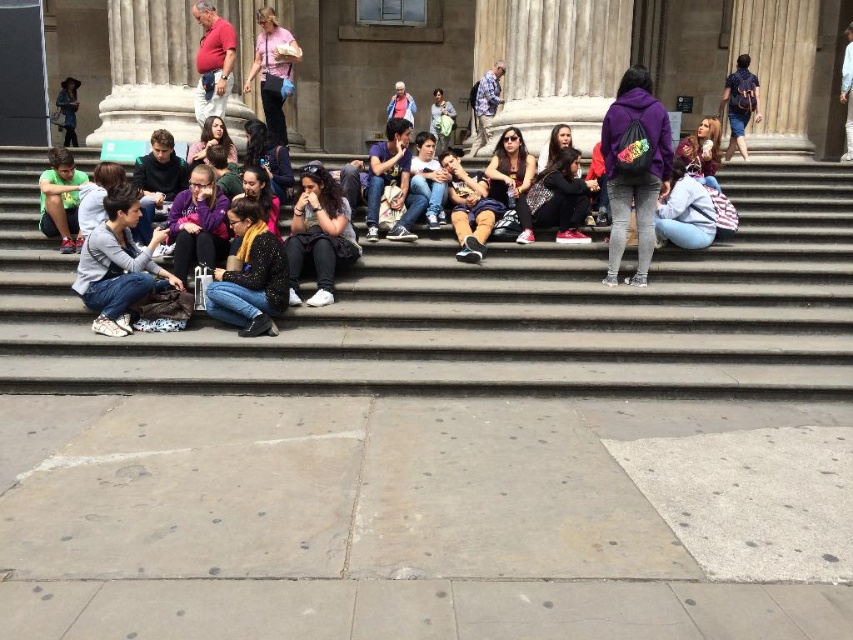
Does purple fleece jacket at center have a greater width compared to matte purple hoodie at center?

Correct, the width of purple fleece jacket at center exceeds that of matte purple hoodie at center.

Is point (637, 92) farther from viewer compared to point (437, 90)?

No, it is in front of (437, 90).

The width and height of the screenshot is (853, 640). In order to click on purple fleece jacket at center in this screenshot , I will do `click(634, 168)`.

At what (x,y) coordinates should I click in order to perform the action: click on purple fleece jacket at center. Please return your answer as a coordinate pair (x, y). Looking at the image, I should click on (634, 168).

Describe the element at coordinates (486, 310) in the screenshot. The height and width of the screenshot is (640, 853). I see `gray concrete stairs at center` at that location.

Which of these two, gray concrete stairs at center or matte red shirt at upper center, stands shorter?

Standing shorter between the two is gray concrete stairs at center.

You are a GUI agent. You are given a task and a screenshot of the screen. Output one action in this format:
    pyautogui.click(x=<x>, y=<y>)
    Task: Click on the gray concrete stairs at center
    The height and width of the screenshot is (640, 853).
    Given the screenshot: What is the action you would take?
    pyautogui.click(x=486, y=310)

Which is above, matte black jacket at center or light blue denim jacket at upper center?

light blue denim jacket at upper center

Between matte black jacket at center and light blue denim jacket at upper center, which one appears on the right side from the viewer's perspective?

light blue denim jacket at upper center

Between point (323, 241) and point (851, 141), which one is positioned behind?

The point (851, 141) is behind.

What are the coordinates of `matte black jacket at center` in the screenshot? It's located at (318, 236).